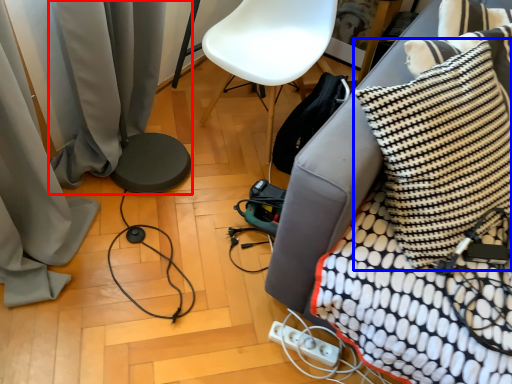
Question: Which point is closer to the camera, curtain (highlighted by a red box) or pillow (highlighted by a blue box)?

Choices:
 (A) curtain
 (B) pillow

Answer: (B)